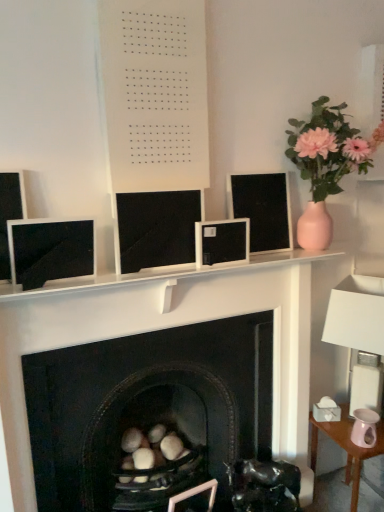
Question: Does black matte monitor at center, the 3th computer monitor in the right-to-left sequence, have a larger size compared to white matte board at upper center?

Choices:
 (A) no
 (B) yes

Answer: (A)

Question: From the image's perspective, is black matte monitor at center, the 3th computer monitor in the right-to-left sequence, over white matte board at upper center?

Choices:
 (A) no
 (B) yes

Answer: (A)

Question: Does black matte monitor at center, the 2th computer monitor viewed from the left, have a lesser height compared to white matte board at upper center?

Choices:
 (A) yes
 (B) no

Answer: (A)

Question: From a real-world perspective, is black matte monitor at center, the 3th computer monitor in the right-to-left sequence, below white matte board at upper center?

Choices:
 (A) no
 (B) yes

Answer: (B)

Question: Is white matte board at upper center at the back of black matte monitor at center, the 2th computer monitor viewed from the left?

Choices:
 (A) yes
 (B) no

Answer: (B)

Question: Considering the relative positions of black matte fireplace at center and black glossy swivel chair at center in the image provided, is black matte fireplace at center to the left or to the right of black glossy swivel chair at center?

Choices:
 (A) left
 (B) right

Answer: (A)

Question: Is black matte fireplace at center taller or shorter than black glossy swivel chair at center?

Choices:
 (A) short
 (B) tall

Answer: (B)

Question: Is black matte fireplace at center in front of or behind black glossy swivel chair at center in the image?

Choices:
 (A) front
 (B) behind

Answer: (A)

Question: Does point (322, 362) appear closer or farther from the camera than point (284, 493)?

Choices:
 (A) closer
 (B) farther

Answer: (B)

Question: From a real-world perspective, is pink ceramic table at lower right above or below pink ceramic vase at upper right?

Choices:
 (A) below
 (B) above

Answer: (A)

Question: Is pink ceramic table at lower right taller or shorter than pink ceramic vase at upper right?

Choices:
 (A) short
 (B) tall

Answer: (A)

Question: Is pink ceramic table at lower right to the left or to the right of pink ceramic vase at upper right in the image?

Choices:
 (A) right
 (B) left

Answer: (A)

Question: In the image, is pink ceramic table at lower right positioned in front of or behind pink ceramic vase at upper right?

Choices:
 (A) behind
 (B) front

Answer: (A)

Question: In terms of height, does matte black monitor at left, the first computer monitor positioned from the left, look taller or shorter compared to white fabric lampshade at right?

Choices:
 (A) short
 (B) tall

Answer: (A)

Question: Looking at their shapes, would you say matte black monitor at left, the first computer monitor positioned from the left, is wider or thinner than white fabric lampshade at right?

Choices:
 (A) thin
 (B) wide

Answer: (A)